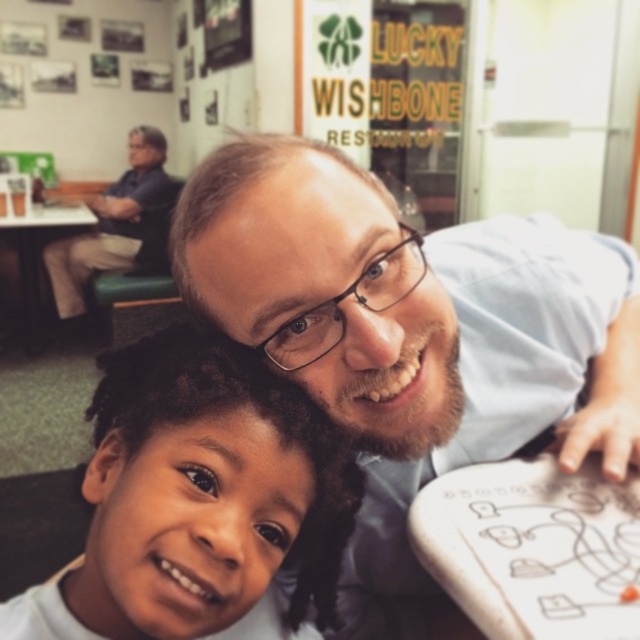
Who is taller, smooth skin child at center or dark blue shirt at upper left?

With more height is dark blue shirt at upper left.

Locate an element on the screen. The image size is (640, 640). smooth skin child at center is located at coordinates (196, 499).

The height and width of the screenshot is (640, 640). In order to click on smooth skin child at center in this screenshot , I will do `click(196, 499)`.

Can you confirm if light blue shirt at center is wider than dark blue shirt at upper left?

No.

Is light blue shirt at center positioned behind dark blue shirt at upper left?

No, light blue shirt at center is in front of dark blue shirt at upper left.

In the scene shown: Who is more distant from viewer, (x=490, y=339) or (x=179, y=184)?

Positioned behind is point (x=179, y=184).

Where is `light blue shirt at center`? The height and width of the screenshot is (640, 640). light blue shirt at center is located at coordinates (410, 336).

Does light blue shirt at center have a lesser width compared to smooth skin child at center?

No, light blue shirt at center is not thinner than smooth skin child at center.

Where is `light blue shirt at center`? This screenshot has height=640, width=640. light blue shirt at center is located at coordinates (410, 336).

This screenshot has height=640, width=640. I want to click on light blue shirt at center, so click(x=410, y=336).